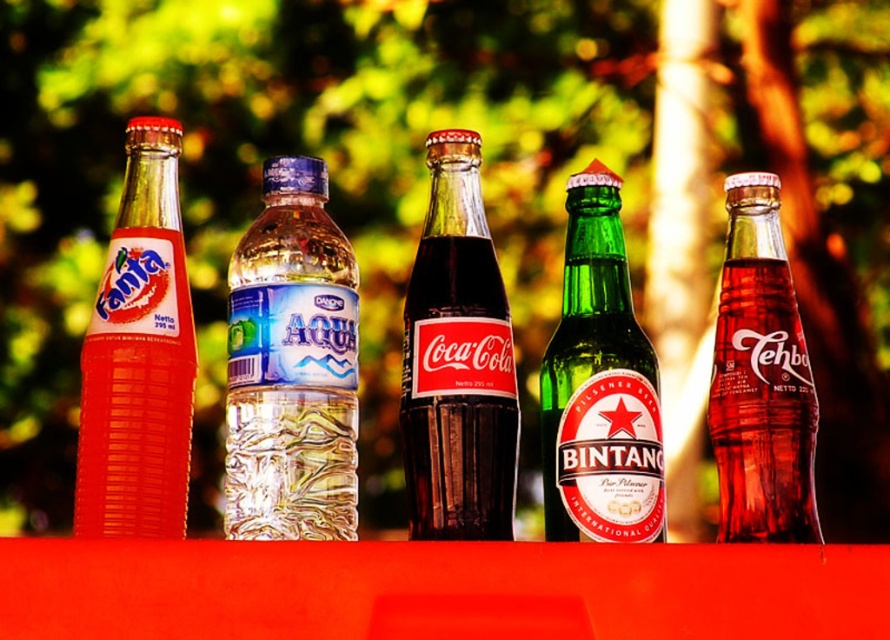
You are a delivery person who needs to place a new bottle exactly at the coordinates given in the image. The new bottle must be placed between the Fanta Bottle and the Aqua Bottle. Is the position of the clear plastic bottle at center suitable for this task?

The clear plastic bottle at center is already positioned at the coordinates given, so placing the new bottle there would not be between the Fanta Bottle and the Aqua Bottle. Choose another spot between them instead.

You are standing in front of the beverage bottles on the red surface. If you want to grab the translucent glass fanta bottle at left, will you need to move the clear plastic bottle at center first?

The translucent glass fanta bottle at left is behind the clear plastic bottle at center, so yes, you will need to move the clear plastic bottle at center first to access it.

You are a delivery person who needs to place a new bottle between the clear plastic bottle at center and the translucent glass bottle at center. The new bottle is 3 inches wide. Can you fit it between them without moving the existing bottles?

The clear plastic bottle at center is 7.57 inches away from the translucent glass bottle at center. Since the new bottle is only 3 inches wide, there is enough space between them to fit it without moving the existing bottles.